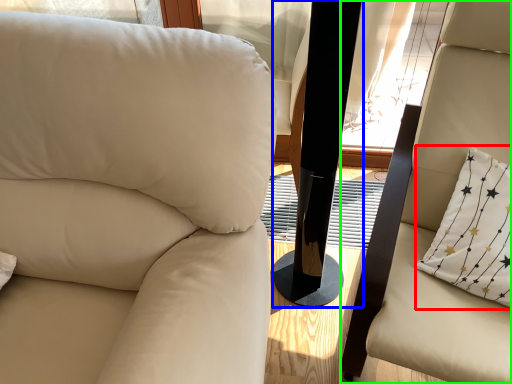
Question: Estimate the real-world distances between objects in this image. Which object is closer to pillow (highlighted by a red box), pillar (highlighted by a blue box) or chair (highlighted by a green box)?

Choices:
 (A) pillar
 (B) chair

Answer: (B)